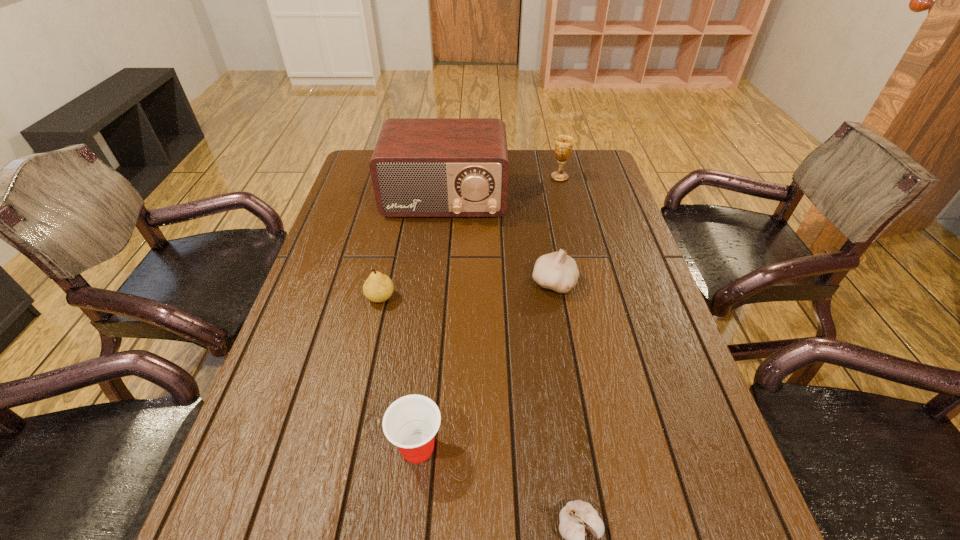
Where is `blank space at the far right corner`? The height and width of the screenshot is (540, 960). blank space at the far right corner is located at coordinates (571, 152).

Find the location of a particular element. free space between the tallest object and the farther garlic is located at coordinates (499, 241).

This screenshot has width=960, height=540. I want to click on free area in between the pear and the chalice, so click(x=470, y=237).

This screenshot has height=540, width=960. What are the coordinates of `free point between the tallest object and the pear` in the screenshot? It's located at (413, 248).

You are a GUI agent. You are given a task and a screenshot of the screen. Output one action in this format:
    pyautogui.click(x=<x>, y=<y>)
    Task: Click on the blank region between the farther garlic and the fifth shortest object
    
    Given the screenshot: What is the action you would take?
    pyautogui.click(x=557, y=230)

Find the location of `free space that is in between the chalice and the pear`. free space that is in between the chalice and the pear is located at coordinates (470, 237).

Identify which object is located as the third nearest to the cup. Please provide its 2D coordinates. Your answer should be formatted as a tuple, i.e. [(x, y)], where the tuple contains the x and y coordinates of a point satisfying the conditions above.

[(557, 271)]

Select which object is the second closest to the tallest object. Please provide its 2D coordinates. Your answer should be formatted as a tuple, i.e. [(x, y)], where the tuple contains the x and y coordinates of a point satisfying the conditions above.

[(557, 271)]

The height and width of the screenshot is (540, 960). What are the coordinates of `free space that satisfies the following two spatial constraints: 1. on the back side of the cup; 2. on the left side of the taller garlic` in the screenshot? It's located at (435, 284).